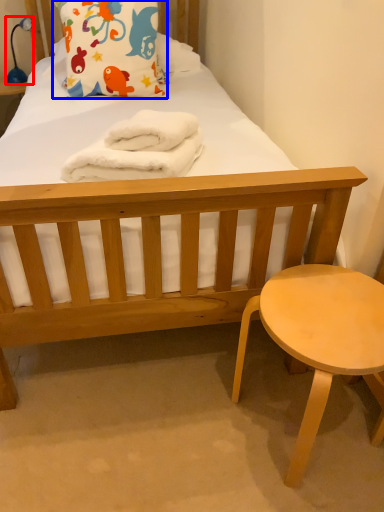
Question: Which object is closer to the camera taking this photo, lamp (highlighted by a red box) or pillow (highlighted by a blue box)?

Choices:
 (A) lamp
 (B) pillow

Answer: (B)